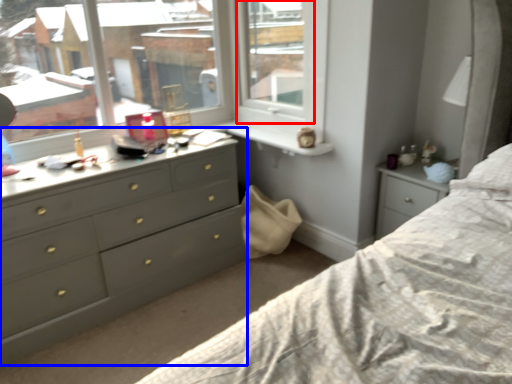
Question: Which point is further to the camera, window frame (highlighted by a red box) or chest of drawers (highlighted by a blue box)?

Choices:
 (A) window frame
 (B) chest of drawers

Answer: (A)